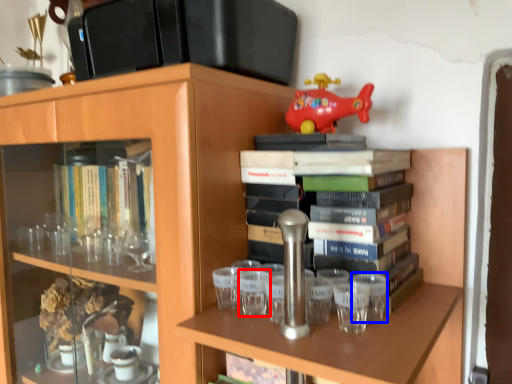
Question: Which object appears closest to the camera in this image, shot glass (highlighted by a red box) or shot glass (highlighted by a blue box)?

Choices:
 (A) shot glass
 (B) shot glass

Answer: (B)